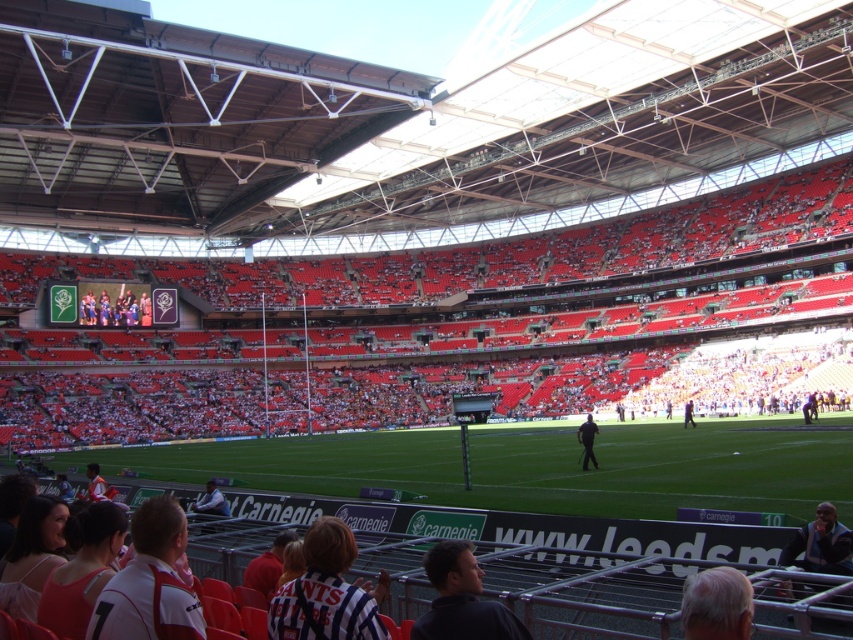
You are a photographer at the stadium and want to capture a photo of the striped jersey at lower center and gray hair at lower right. Which object should you focus on first if you want to ensure both are in the frame without moving the camera?

You should focus on the striped jersey at lower center first because it is larger in size than the gray hair at lower right, making it easier to center and frame properly before adjusting for the smaller object.

You are a photographer positioned at the front of the stadium. You want to take a photo that includes both the gray hair at lower right and the light brown leather jacket at center. Which object should you focus on first to ensure both are in frame?

The gray hair at lower right is above the light brown leather jacket at center, so you should focus on the light brown leather jacket at center first to ensure both are in frame.

You are sitting in the stands of the stadium and want to take a photo of both the point at coordinates (312, 580) and the point at coordinates (708, 577). Which point will appear closer to the bottom of your camera view?

Point (708, 577) will appear closer to the bottom of your camera view because it is closer to the camera than point (312, 580).